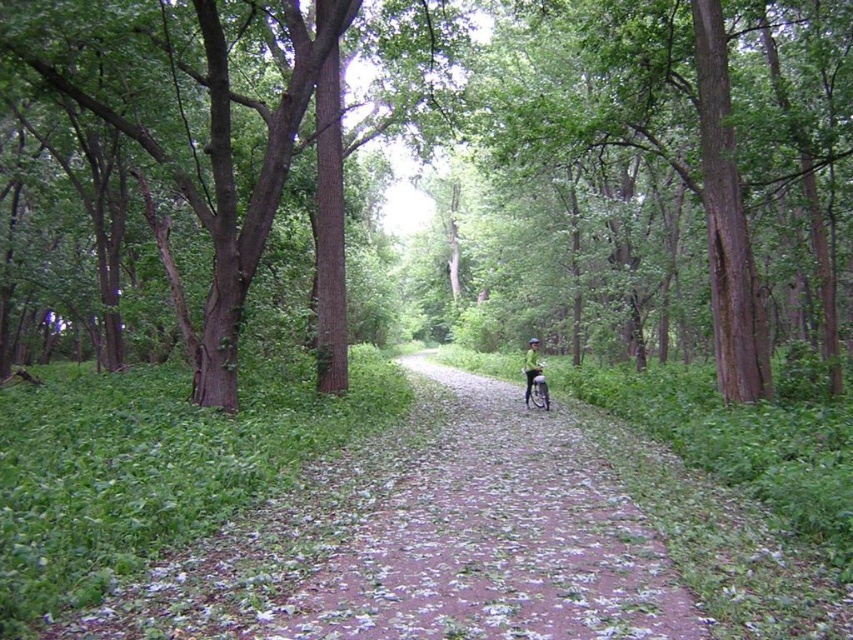
How far apart are brown rough tree at center and green fabric helmet at center?

brown rough tree at center is 32.91 feet away from green fabric helmet at center.

Does brown rough tree at center appear over green fabric helmet at center?

Correct, brown rough tree at center is located above green fabric helmet at center.

Between point (592, 22) and point (532, 346), which one is positioned behind?

Point (592, 22)

I want to click on brown rough tree at center, so click(x=461, y=164).

Is brown rough tree at center positioned in front of brown dirt path at center?

No, it is behind brown dirt path at center.

Who is positioned more to the left, brown rough tree at center or brown dirt path at center?

Positioned to the left is brown rough tree at center.

Which is in front, point (700, 314) or point (531, 497)?

Point (531, 497) is in front.

This screenshot has width=853, height=640. Identify the location of brown rough tree at center. (461, 164).

Is point (659, 595) farther from viewer compared to point (531, 355)?

No.

Is brown dirt path at center smaller than green fabric helmet at center?

Yes.

Between point (576, 506) and point (524, 396), which one is positioned in front?

Positioned in front is point (576, 506).

Locate an element on the screen. brown dirt path at center is located at coordinates 495,541.